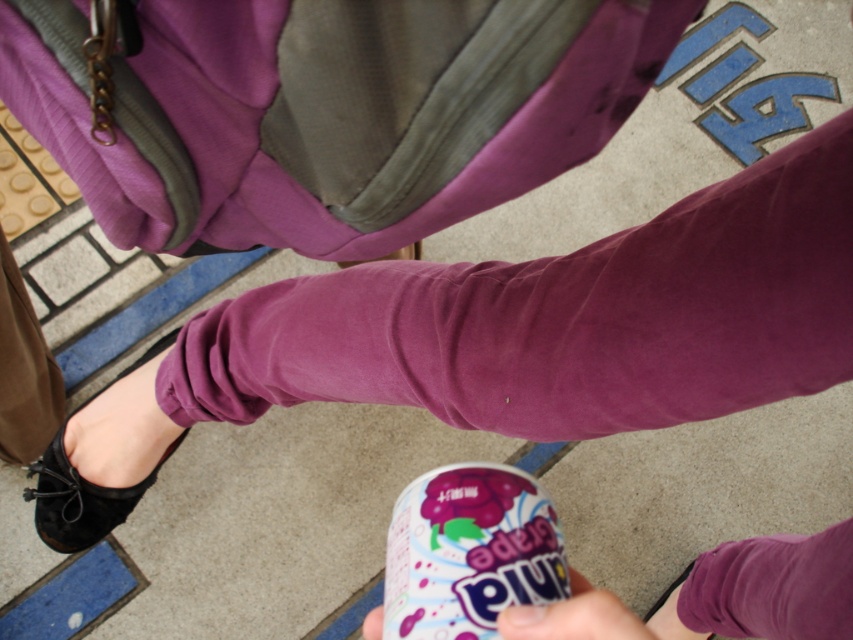
Is point (460, 474) more distant than point (563, 621)?

That is True.

Which of these two, glossy plastic can at lower center or pink matte can at lower center, stands taller?

glossy plastic can at lower center is taller.

Describe the element at coordinates (469, 552) in the screenshot. The image size is (853, 640). I see `glossy plastic can at lower center` at that location.

You are a GUI agent. You are given a task and a screenshot of the screen. Output one action in this format:
    pyautogui.click(x=<x>, y=<y>)
    Task: Click on the glossy plastic can at lower center
    
    Given the screenshot: What is the action you would take?
    pyautogui.click(x=469, y=552)

Which is behind, point (477, 614) or point (114, 525)?

Point (114, 525)

What do you see at coordinates (469, 552) in the screenshot?
I see `glossy plastic can at lower center` at bounding box center [469, 552].

Identify the location of glossy plastic can at lower center. (469, 552).

Who is positioned more to the left, black suede shoe at lower left or pink matte can at lower center?

black suede shoe at lower left is more to the left.

Does black suede shoe at lower left have a greater height compared to pink matte can at lower center?

Correct, black suede shoe at lower left is much taller as pink matte can at lower center.

The width and height of the screenshot is (853, 640). I want to click on black suede shoe at lower left, so click(x=85, y=484).

Find the location of `black suede shoe at lower left`. black suede shoe at lower left is located at coordinates (85, 484).